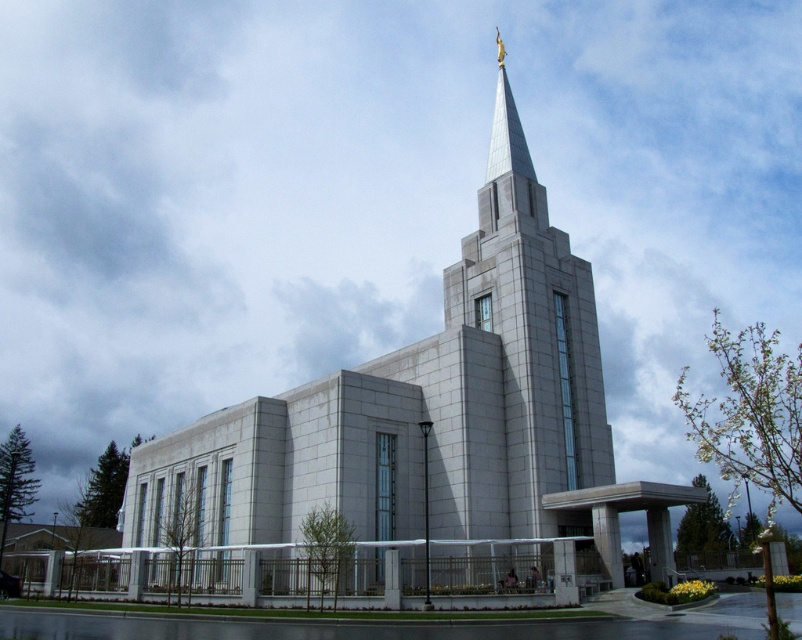
Is white stone church at center closer to camera compared to white stone spire at center?

Yes, it is in front of white stone spire at center.

Which is below, white stone church at center or white stone spire at center?

white stone church at center is lower down.

What do you see at coordinates (430, 416) in the screenshot? The height and width of the screenshot is (640, 802). I see `white stone church at center` at bounding box center [430, 416].

Find the location of a particular element. The image size is (802, 640). white stone church at center is located at coordinates (430, 416).